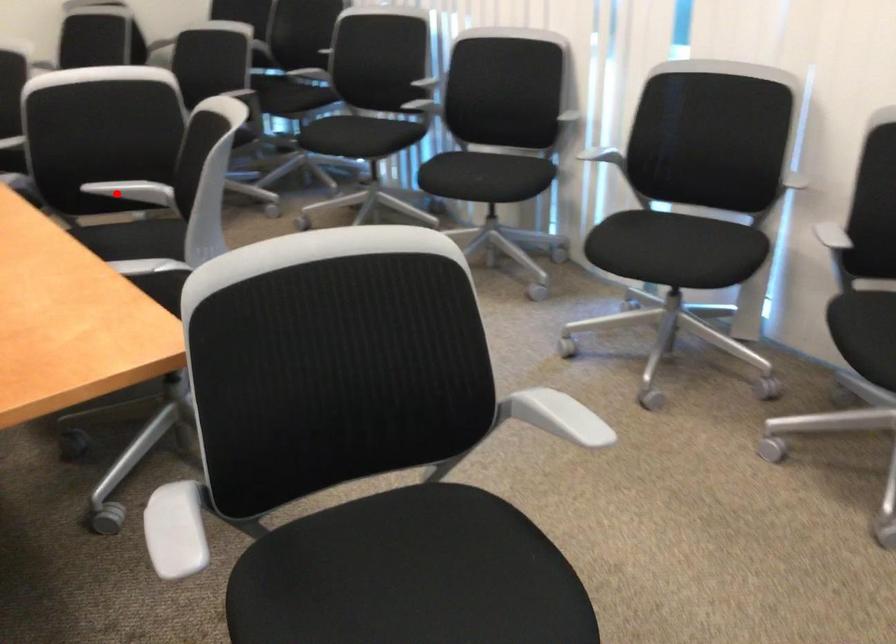
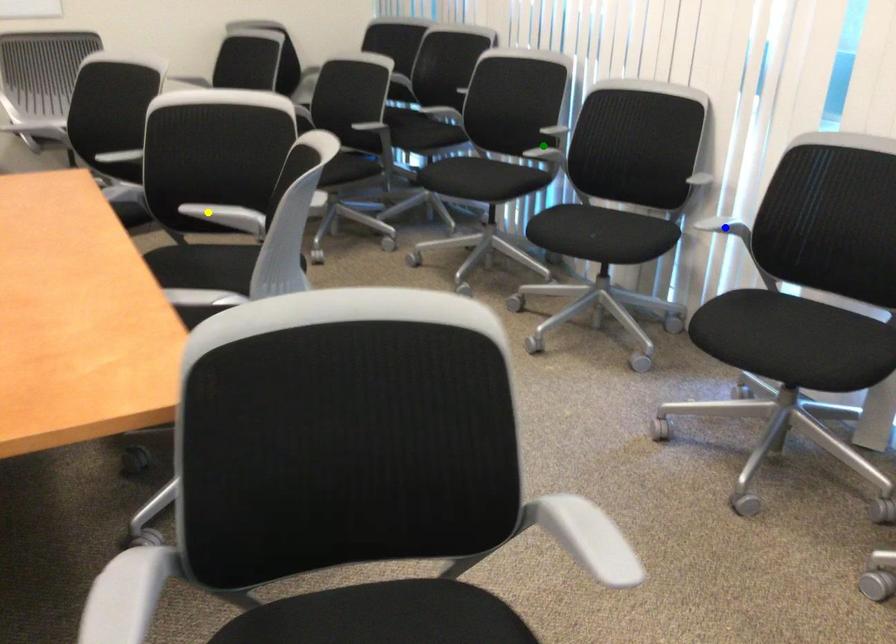
Question: I am providing you with two images of the same scene from different viewpoints. A red point is marked on the first image. You are given multiple points on the second image. Can you choose the point in image 2 that corresponds to the point in image 1?

Choices:
 (A) blue point
 (B) yellow point
 (C) green point

Answer: (B)